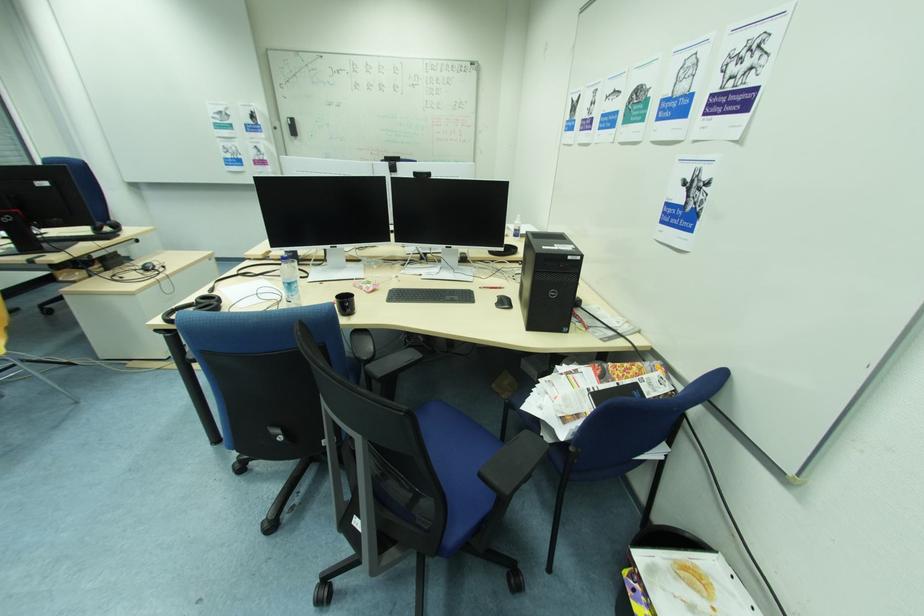
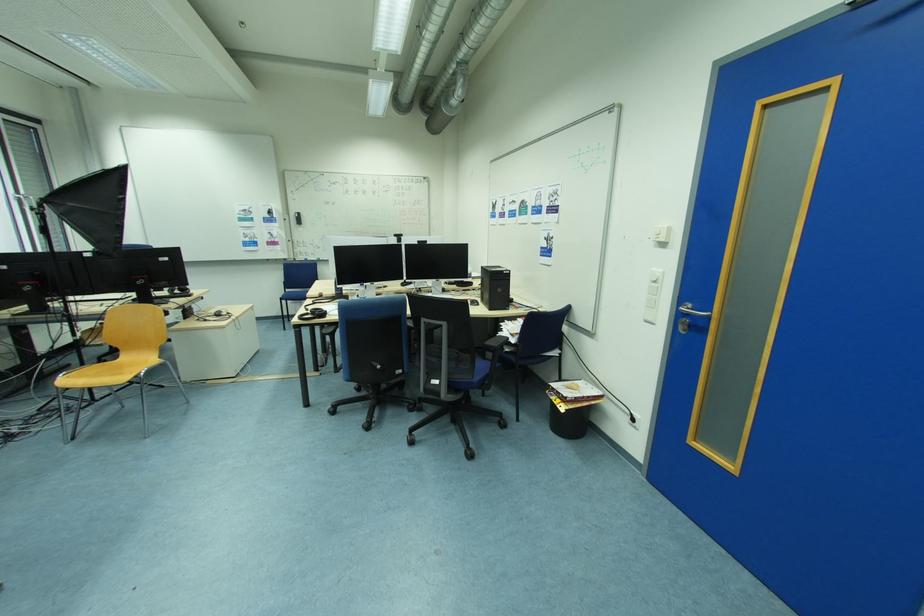
Where in the second image is the point corresponding to (x=582, y=416) from the first image?

(525, 334)